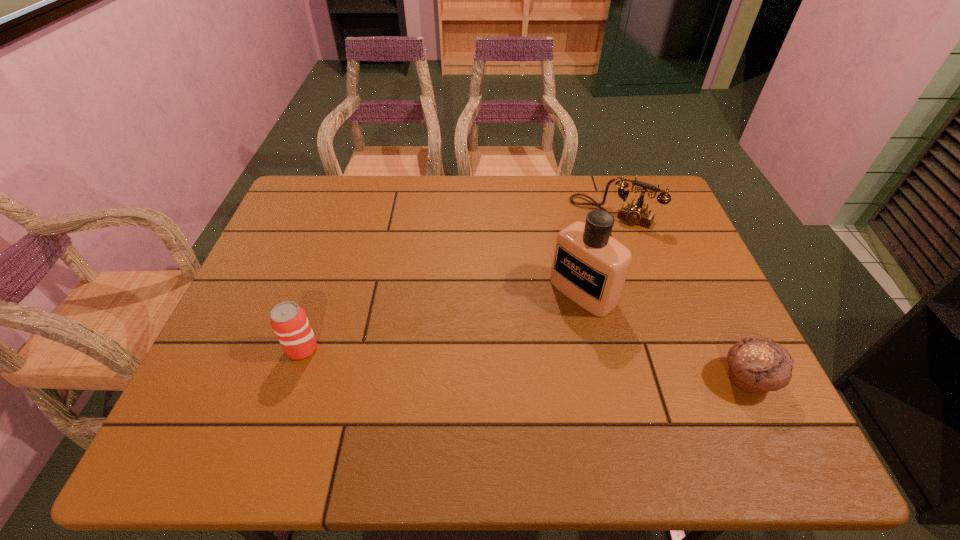
This screenshot has height=540, width=960. What are the coordinates of `vacant space on the desktop that is between the beer can and the shortest object and is positioned on the front-facing side of the farthest object` in the screenshot? It's located at (510, 363).

Where is `free spot on the desktop that is between the beer can and the muffin and is positioned on the front label of the second farthest object`? This screenshot has width=960, height=540. free spot on the desktop that is between the beer can and the muffin and is positioned on the front label of the second farthest object is located at coordinates (493, 362).